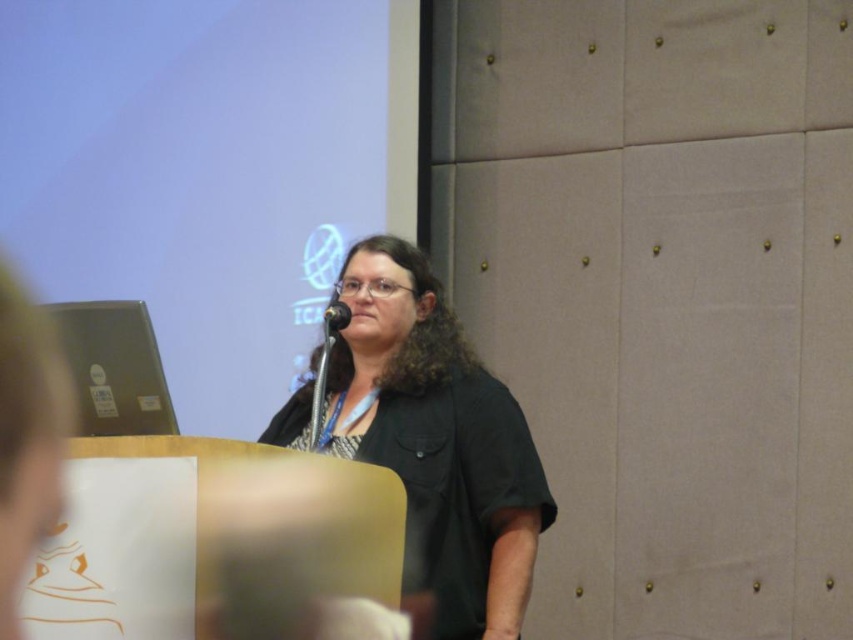
Is black matte shirt at center further to the viewer compared to satin silver laptop at left?

Yes.

Looking at this image, is black matte shirt at center smaller than satin silver laptop at left?

No, black matte shirt at center is not smaller than satin silver laptop at left.

The width and height of the screenshot is (853, 640). What do you see at coordinates (437, 442) in the screenshot?
I see `black matte shirt at center` at bounding box center [437, 442].

Where is `black matte shirt at center`? This screenshot has height=640, width=853. black matte shirt at center is located at coordinates (437, 442).

Is satin silver laptop at left thinner than black metallic microphone at center?

No, satin silver laptop at left is not thinner than black metallic microphone at center.

The image size is (853, 640). Describe the element at coordinates (114, 368) in the screenshot. I see `satin silver laptop at left` at that location.

Where is `satin silver laptop at left`? The image size is (853, 640). satin silver laptop at left is located at coordinates (114, 368).

Does black matte shirt at center appear on the right side of black metallic microphone at center?

Indeed, black matte shirt at center is positioned on the right side of black metallic microphone at center.

From the picture: Who is more forward, (x=335, y=340) or (x=334, y=326)?

Point (x=334, y=326) is in front.

In order to click on black matte shirt at center in this screenshot , I will do `click(437, 442)`.

I want to click on black matte shirt at center, so click(x=437, y=442).